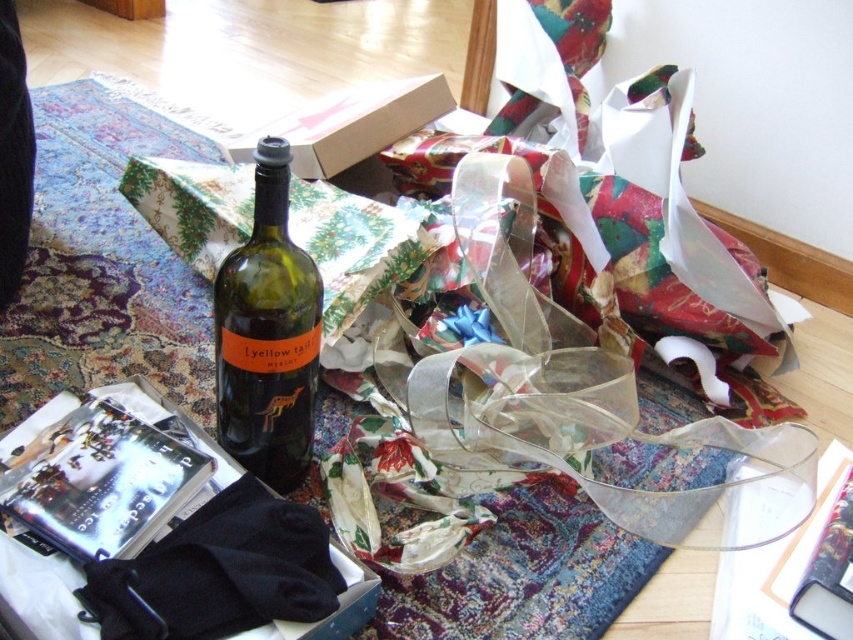
Is point (264, 196) closer to camera compared to point (373, 84)?

Yes, it is.

Which of these two, green glass bottle at center or matte cardboard box at center, stands taller?

With more height is green glass bottle at center.

Does point (305, 470) come farther from viewer compared to point (320, 134)?

No, (305, 470) is in front of (320, 134).

The width and height of the screenshot is (853, 640). Identify the location of green glass bottle at center. (267, 336).